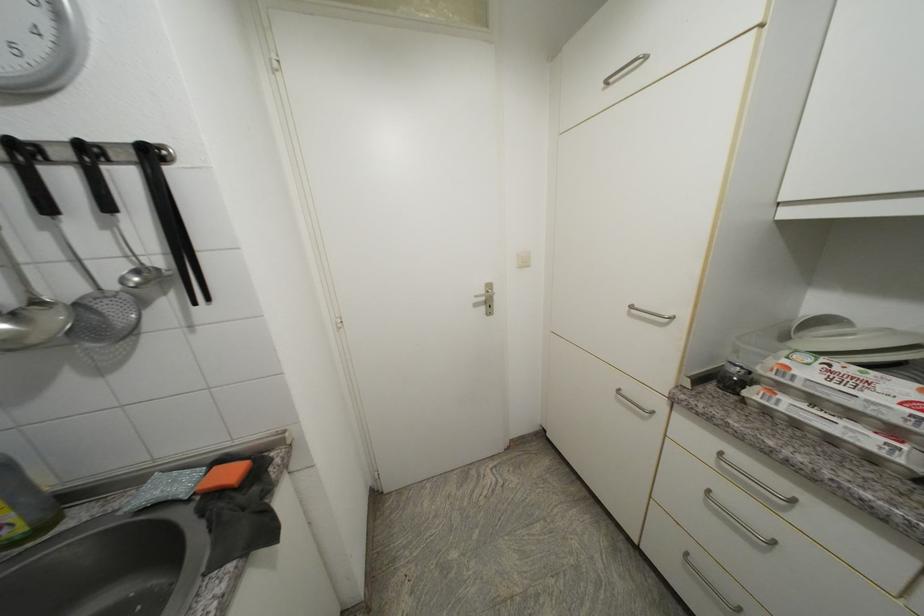
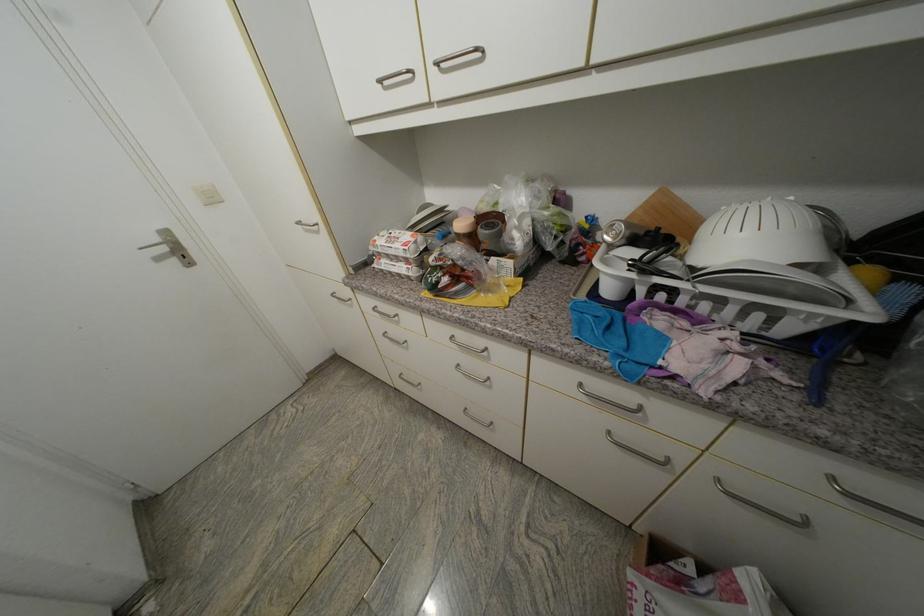
How did the camera likely rotate?

The camera rotated toward right-down.